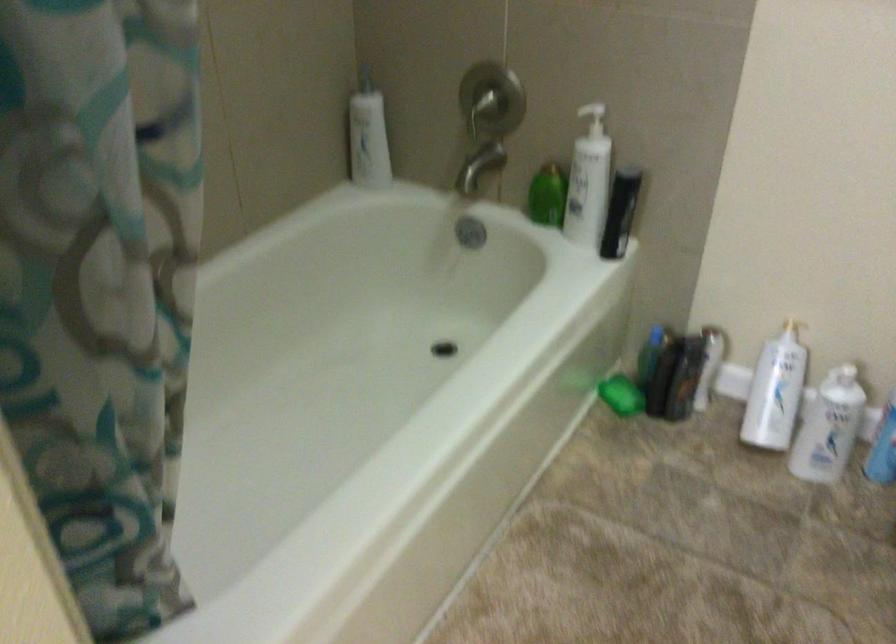
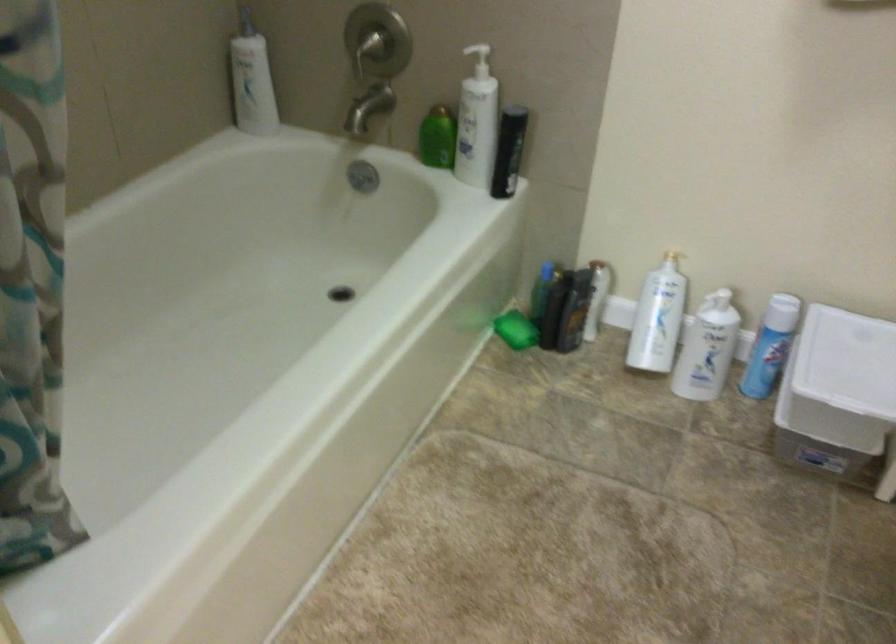
Where in the second image is the point corresponding to pixel 685 379 from the first image?

(574, 310)